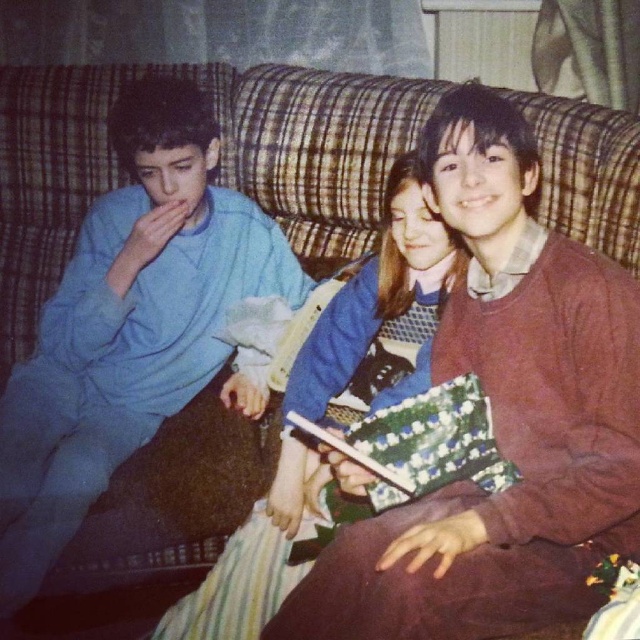
Question: Is matte blue sweater at left thinner than blue knit sweater at center?

Choices:
 (A) no
 (B) yes

Answer: (A)

Question: Can you confirm if matte blue sweater at left is positioned to the right of blue knit sweater at center?

Choices:
 (A) yes
 (B) no

Answer: (B)

Question: Which point appears farthest from the camera in this image?

Choices:
 (A) (214, 355)
 (B) (268, 525)

Answer: (A)

Question: Which of the following is the closest to the observer?

Choices:
 (A) (6, 595)
 (B) (326, 298)

Answer: (A)

Question: Can you confirm if matte blue sweater at left is positioned above blue knit sweater at center?

Choices:
 (A) yes
 (B) no

Answer: (A)